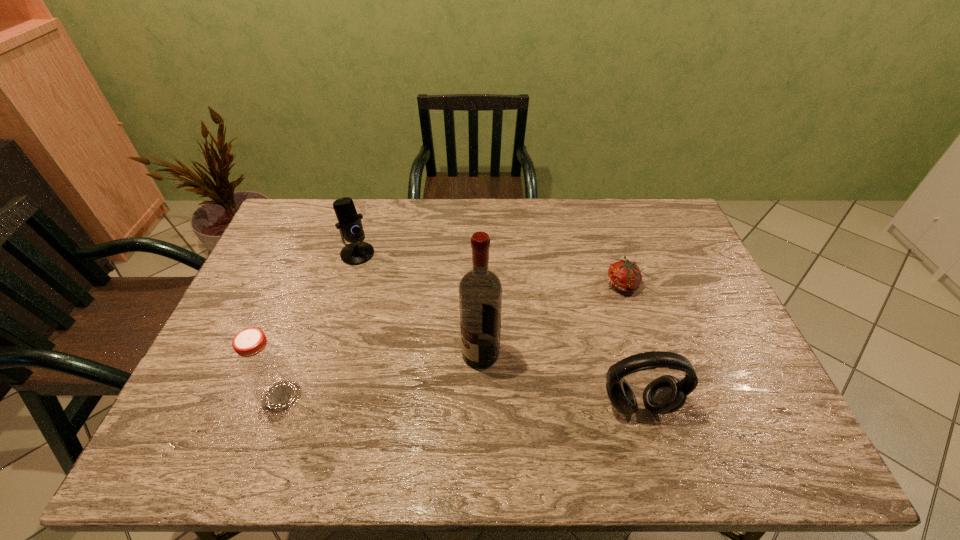
In the image, there is a desktop. At what (x,y) coordinates should I click in order to perform the action: click on vacant space at the near edge. Please return your answer as a coordinate pair (x, y). Image resolution: width=960 pixels, height=540 pixels. Looking at the image, I should click on (439, 405).

In the image, there is a desktop. Identify the location of vacant space at the left edge. This screenshot has width=960, height=540. (273, 276).

The height and width of the screenshot is (540, 960). In order to click on vacant space at the far left corner of the desktop in this screenshot , I will do `click(300, 202)`.

The image size is (960, 540). I want to click on free space at the far right corner of the desktop, so click(x=645, y=204).

The height and width of the screenshot is (540, 960). I want to click on free space between the headset and the fourth nearest object, so click(631, 345).

Where is `free space that is in between the fourth nearest object and the alcohol`? This screenshot has height=540, width=960. free space that is in between the fourth nearest object and the alcohol is located at coordinates (552, 319).

Locate an element on the screen. This screenshot has width=960, height=540. unoccupied position between the bottle and the tomato is located at coordinates (452, 340).

Find the location of a particular element. This screenshot has height=540, width=960. vacant space that's between the fourth nearest object and the bottle is located at coordinates (452, 340).

Where is `free space between the microphone and the bottle`? The image size is (960, 540). free space between the microphone and the bottle is located at coordinates (320, 325).

At what (x,y) coordinates should I click in order to perform the action: click on free point between the bottle and the tomato. Please return your answer as a coordinate pair (x, y). The height and width of the screenshot is (540, 960). Looking at the image, I should click on (452, 340).